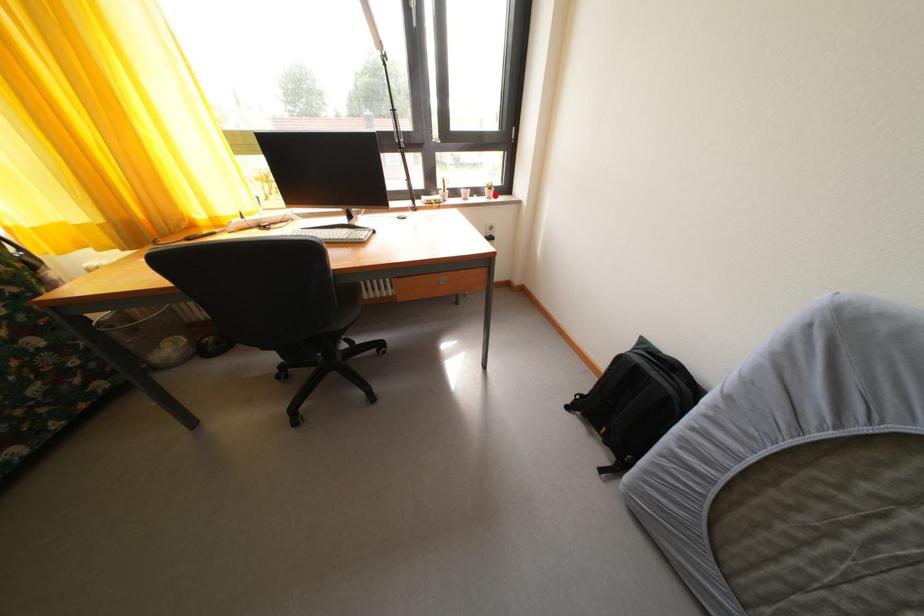
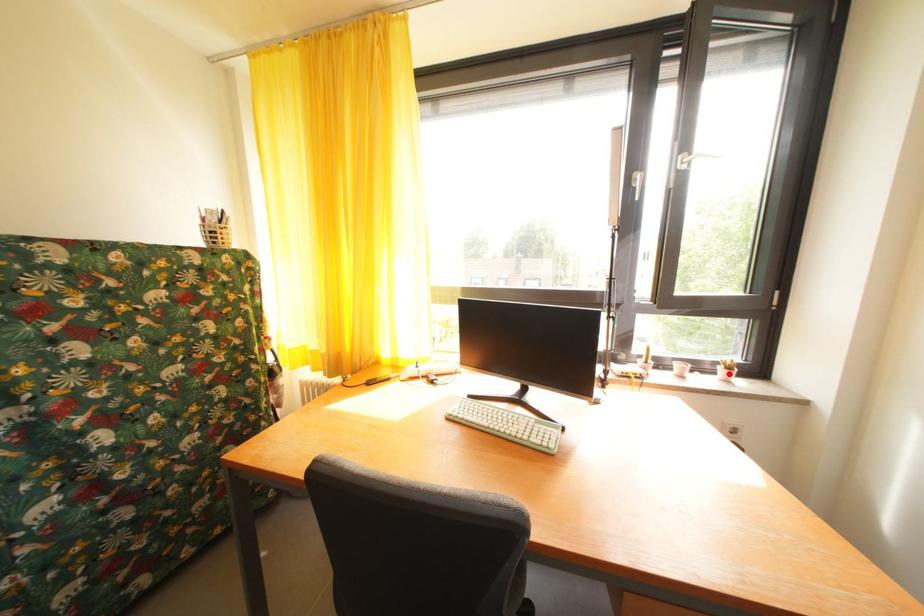
I am providing you with two images of the same scene from different viewpoints. A red point is marked on the first image and another point is marked on the second image. Are the points marked in image1 and image2 representing the same 3D position?

Yes